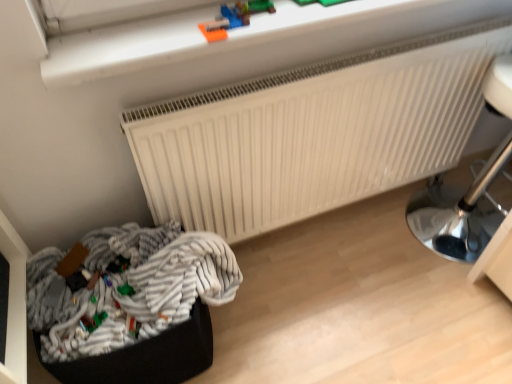
Find the location of a particular element. Image resolution: width=512 pixels, height=384 pixels. empty space that is to the right of green plastic toy at lower left, which ranks as the first toy in left-to-right order is located at coordinates (142, 324).